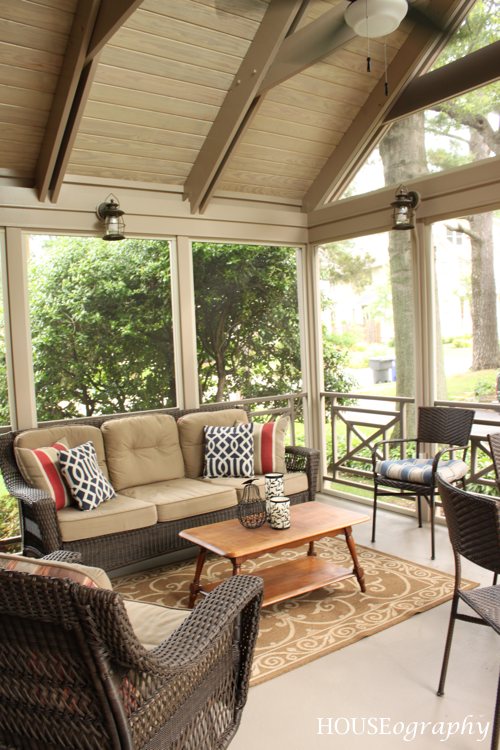
Identify the location of coffee table. (245, 546).